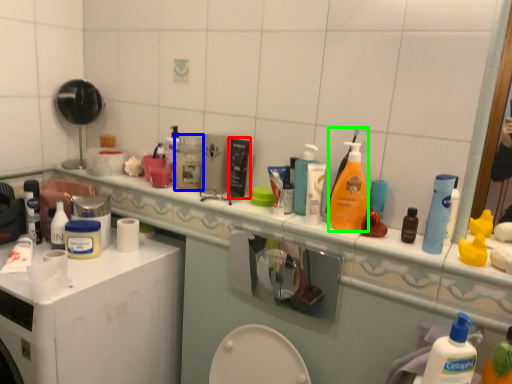
Question: Which object is the farthest from product (highlighted by a red box)? Choose among these: mouthwash (highlighted by a blue box) or cleaning product (highlighted by a green box).

Choices:
 (A) mouthwash
 (B) cleaning product

Answer: (B)